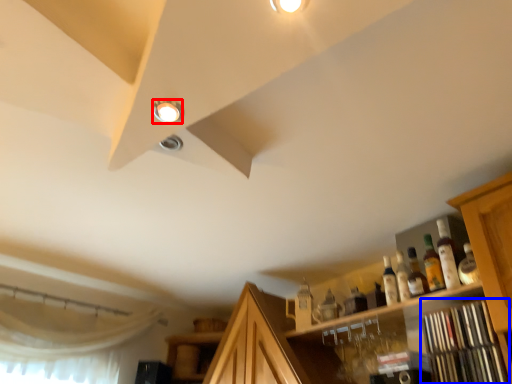
Question: Which point is further to the camera, droplight (highlighted by a red box) or shelf (highlighted by a blue box)?

Choices:
 (A) droplight
 (B) shelf

Answer: (B)